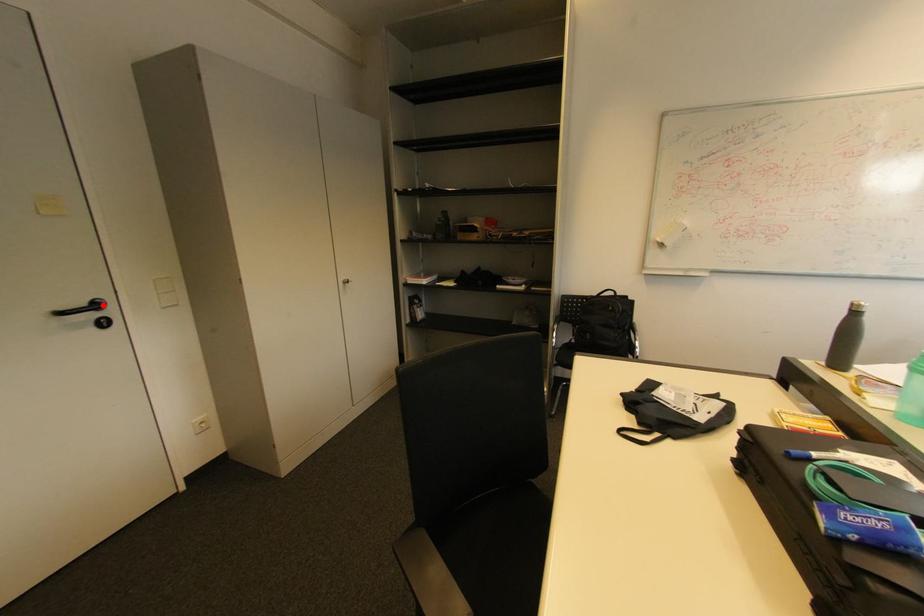
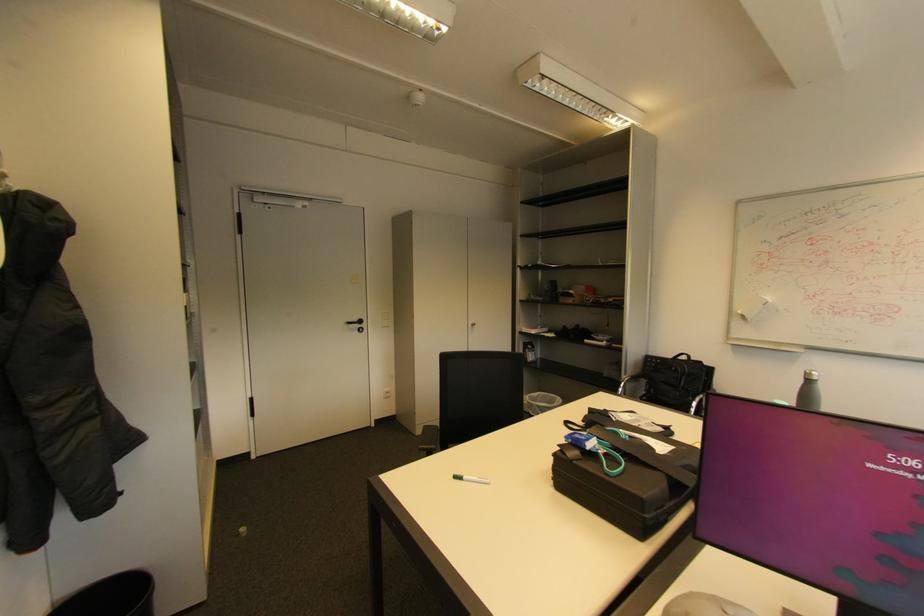
The point at the highlighted location is marked in the first image. Where is the corresponding point in the second image?

(366, 322)